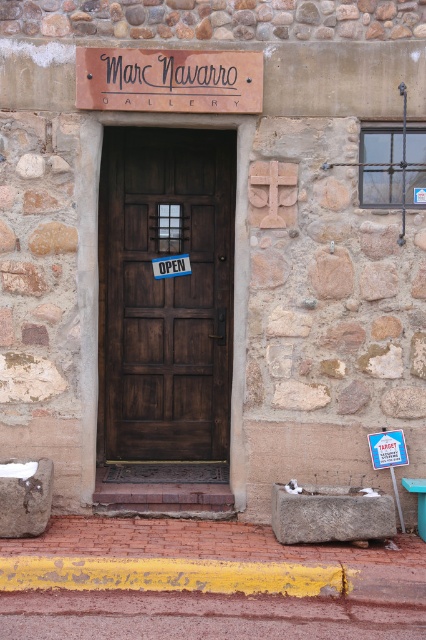
Is blue plastic sign at lower right bigger than blue paper sign at door center?

Correct, blue plastic sign at lower right is larger in size than blue paper sign at door center.

Between blue plastic sign at lower right and blue paper sign at door center, which one appears on the left side from the viewer's perspective?

From the viewer's perspective, blue paper sign at door center appears more on the left side.

Identify the location of blue plastic sign at lower right. The height and width of the screenshot is (640, 426). (388, 456).

Is rusty metal curb at lower center taller than blue plastic sign at lower right?

No, rusty metal curb at lower center is not taller than blue plastic sign at lower right.

Is point (193, 573) closer to camera compared to point (394, 484)?

Yes.

At what (x,y) coordinates should I click in order to perform the action: click on rusty metal curb at lower center. Please return your answer as a coordinate pair (x, y). This screenshot has height=640, width=426. Looking at the image, I should click on (170, 576).

Image resolution: width=426 pixels, height=640 pixels. In order to click on rusty metal curb at lower center in this screenshot , I will do `click(170, 576)`.

Who is higher up, dark wood door at center or white paper sign at center?

dark wood door at center is higher up.

From the picture: Does dark wood door at center have a greater height compared to white paper sign at center?

Correct, dark wood door at center is much taller as white paper sign at center.

Who is more forward, (180, 243) or (388, 451)?

Point (388, 451) is in front.

Where is `dark wood door at center`? dark wood door at center is located at coordinates (166, 292).